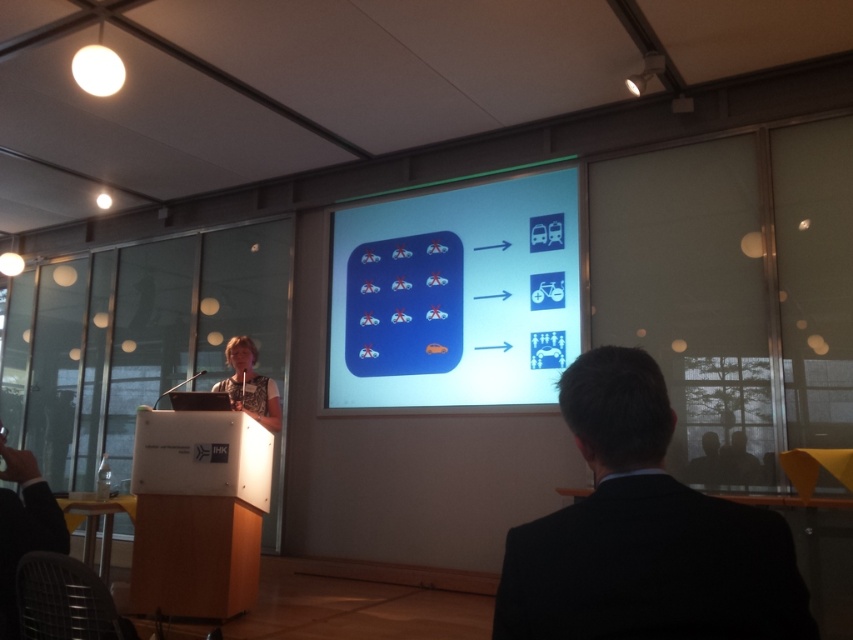
Which is more to the right, white glossy projection screen at center or light beige shirt at left?

white glossy projection screen at center is more to the right.

Image resolution: width=853 pixels, height=640 pixels. What are the coordinates of `white glossy projection screen at center` in the screenshot? It's located at [456, 296].

This screenshot has height=640, width=853. In order to click on white glossy projection screen at center in this screenshot , I will do `click(456, 296)`.

Does black suit at center have a larger size compared to light beige shirt at left?

Incorrect, black suit at center is not larger than light beige shirt at left.

Is black suit at center positioned before light beige shirt at left?

Yes, black suit at center is in front of light beige shirt at left.

Measure the distance between black suit at center and camera.

They are 82.61 centimeters apart.

Where is `black suit at center`? black suit at center is located at coordinates (643, 532).

Can you confirm if black suit at center is smaller than white glossy projection screen at center?

Yes.

Which is more to the left, black suit at center or white glossy projection screen at center?

white glossy projection screen at center is more to the left.

Describe the element at coordinates (643, 532) in the screenshot. I see `black suit at center` at that location.

At what (x,y) coordinates should I click in order to perform the action: click on black suit at center. Please return your answer as a coordinate pair (x, y). The height and width of the screenshot is (640, 853). Looking at the image, I should click on (643, 532).